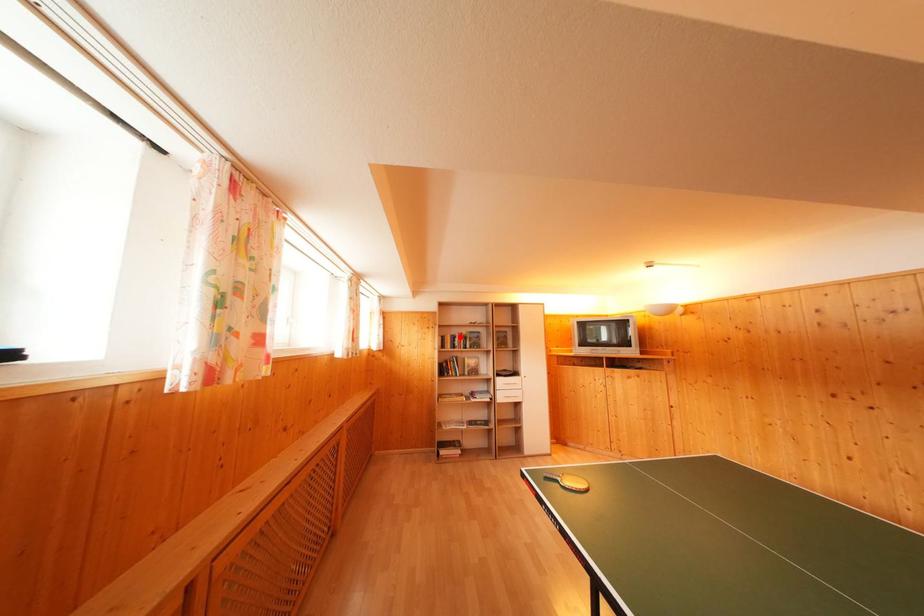
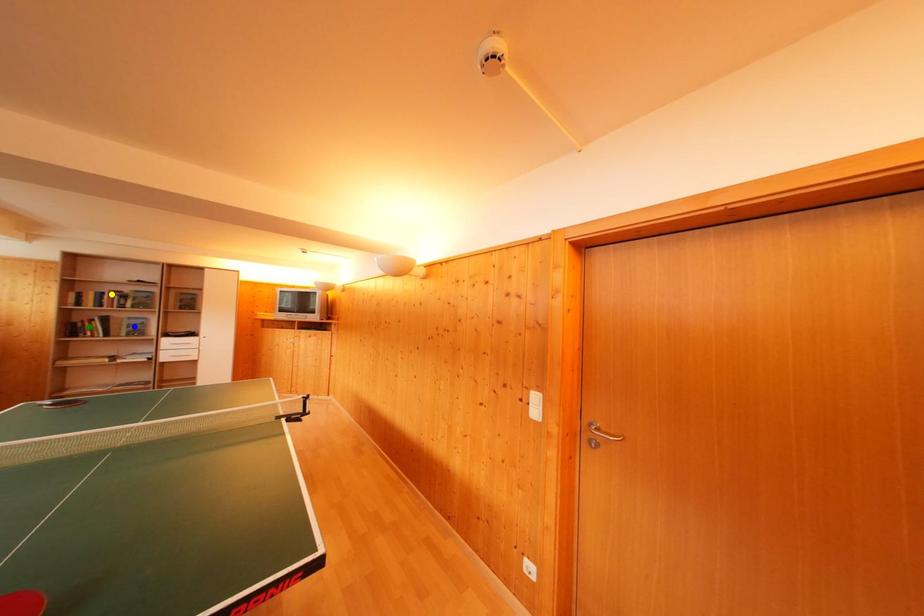
Question: I am providing you with two images of the same scene from different viewpoints. A red point is marked on the first image. You are given multiple points on the second image. Which point in image 2 is actually the same real-world point as the red point in image 1?

Choices:
 (A) blue point
 (B) yellow point
 (C) green point

Answer: (B)